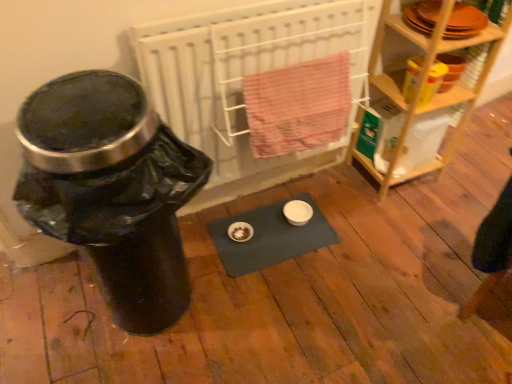
The image size is (512, 384). I want to click on vacant region above blue fabric yoga mat at center (from a real-world perspective), so click(264, 241).